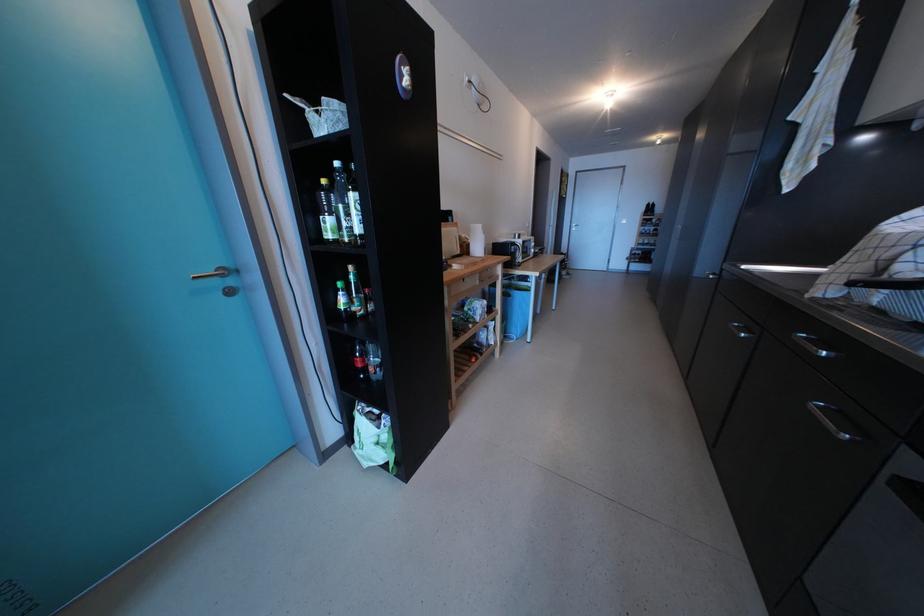
This screenshot has width=924, height=616. I want to click on drawer handle, so click(830, 419).